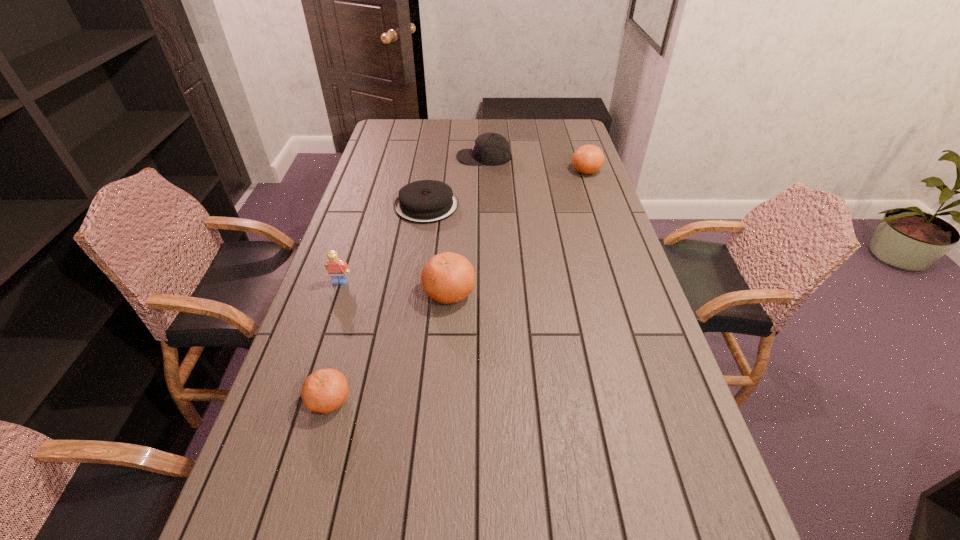
The width and height of the screenshot is (960, 540). Identify the location of the leftmost clementine. (325, 390).

At what (x,y) coordinates should I click in order to perform the action: click on the nearest object. Please return your answer as a coordinate pair (x, y). The width and height of the screenshot is (960, 540). Looking at the image, I should click on (325, 390).

Find the location of `the second nearest clementine`. the second nearest clementine is located at coordinates (447, 277).

Identify the location of the tallest clementine. The height and width of the screenshot is (540, 960). (447, 277).

Image resolution: width=960 pixels, height=540 pixels. I want to click on the second shortest clementine, so click(x=588, y=159).

The width and height of the screenshot is (960, 540). I want to click on the rightmost clementine, so click(x=588, y=159).

Locate an element on the screen. The height and width of the screenshot is (540, 960). cap is located at coordinates coord(489,148).

This screenshot has width=960, height=540. What are the coordinates of `pancake` in the screenshot? It's located at (426, 201).

Identify the location of the shortest object. (426, 201).

At what (x,y) coordinates should I click in order to perform the action: click on Lego. Please return your answer as a coordinate pair (x, y). The width and height of the screenshot is (960, 540). Looking at the image, I should click on (337, 268).